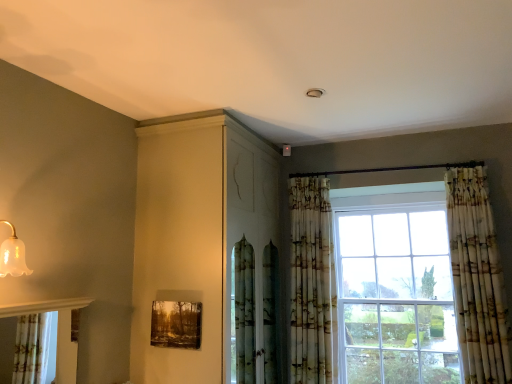
Image resolution: width=512 pixels, height=384 pixels. I want to click on matte white cabinet at upper center, so click(197, 233).

The height and width of the screenshot is (384, 512). I want to click on printed fabric curtain at center, the second curtain positioned from the right, so [311, 281].

Measure the distance between printed fabric curtain at right, which is the 2th curtain in left-to-right order, and camera.

printed fabric curtain at right, which is the 2th curtain in left-to-right order, is 8.75 feet away from camera.

Where is `matte white cabinet at upper center`? Image resolution: width=512 pixels, height=384 pixels. matte white cabinet at upper center is located at coordinates (197, 233).

Is wooden textured frame at lower center shorter than matte white cabinet at upper center?

Correct, wooden textured frame at lower center is not as tall as matte white cabinet at upper center.

Considering the positions of points (167, 337) and (206, 254), is point (167, 337) farther from camera compared to point (206, 254)?

No, (167, 337) is in front of (206, 254).

Between wooden textured frame at lower center and matte white cabinet at upper center, which one appears on the left side from the viewer's perspective?

From the viewer's perspective, wooden textured frame at lower center appears more on the left side.

Can you confirm if wooden textured frame at lower center is smaller than matte white cabinet at upper center?

Yes, wooden textured frame at lower center is smaller than matte white cabinet at upper center.

Is point (245, 129) farther from camera compared to point (177, 312)?

That is True.

Which object is further away from the camera taking this photo, matte white cabinet at upper center or wooden textured frame at lower center?

wooden textured frame at lower center is more distant.

Does matte white cabinet at upper center have a smaller size compared to wooden textured frame at lower center?

No, matte white cabinet at upper center is not smaller than wooden textured frame at lower center.

From the picture: Does printed fabric curtain at center, the second curtain positioned from the right, have a lesser height compared to matte white cabinet at upper center?

Indeed, printed fabric curtain at center, the second curtain positioned from the right, has a lesser height compared to matte white cabinet at upper center.

Is printed fabric curtain at center, the 1th curtain positioned from the left, smaller than matte white cabinet at upper center?

Yes, printed fabric curtain at center, the 1th curtain positioned from the left, is smaller than matte white cabinet at upper center.

Which object is further away from the camera taking this photo, printed fabric curtain at center, the second curtain positioned from the right, or matte white cabinet at upper center?

Positioned behind is printed fabric curtain at center, the second curtain positioned from the right.

Which of these two, wooden textured frame at lower center or printed fabric curtain at center, the second curtain positioned from the right, stands taller?

With more height is printed fabric curtain at center, the second curtain positioned from the right.

From the image's perspective, is wooden textured frame at lower center on top of printed fabric curtain at center, the second curtain positioned from the right?

Incorrect, from the image's perspective, wooden textured frame at lower center is lower than printed fabric curtain at center, the second curtain positioned from the right.

From a real-world perspective, which object stands above the other?

In real-world perspective, printed fabric curtain at center, the 1th curtain positioned from the left, is above.

Looking at this image, does wooden textured frame at lower center turn towards printed fabric curtain at center, the 1th curtain positioned from the left?

No, wooden textured frame at lower center is not oriented towards printed fabric curtain at center, the 1th curtain positioned from the left.

From a real-world perspective, which is physically below, translucent glass bell at upper left or printed fabric curtain at center, the 1th curtain positioned from the left?

From a 3D spatial view, printed fabric curtain at center, the 1th curtain positioned from the left, is below.

Is translucent glass bell at upper left closer to camera compared to printed fabric curtain at center, the second curtain positioned from the right?

Yes.

This screenshot has height=384, width=512. In order to click on light fixture in front of the printed fabric curtain at center, the second curtain positioned from the right in this screenshot , I will do `click(13, 255)`.

Can you confirm if translucent glass bell at upper left is positioned to the left of printed fabric curtain at center, the 1th curtain positioned from the left?

Yes, translucent glass bell at upper left is to the left of printed fabric curtain at center, the 1th curtain positioned from the left.

Considering the relative sizes of translucent glass bell at upper left and printed fabric curtain at right, which is the 2th curtain in left-to-right order, in the image provided, is translucent glass bell at upper left taller than printed fabric curtain at right, which is the 2th curtain in left-to-right order,?

Incorrect, the height of translucent glass bell at upper left is not larger of that of printed fabric curtain at right, which is the 2th curtain in left-to-right order.

Is translucent glass bell at upper left spatially inside printed fabric curtain at right, which is the 2th curtain in left-to-right order, or outside of it?

translucent glass bell at upper left is spatially situated outside printed fabric curtain at right, which is the 2th curtain in left-to-right order.

Considering the sizes of objects translucent glass bell at upper left and printed fabric curtain at right, positioned as the first curtain in right-to-left order, in the image provided, who is wider, translucent glass bell at upper left or printed fabric curtain at right, positioned as the first curtain in right-to-left order,?

printed fabric curtain at right, positioned as the first curtain in right-to-left order, is wider.

Is the position of translucent glass bell at upper left more distant than that of printed fabric curtain at right, positioned as the first curtain in right-to-left order?

No, it is in front of printed fabric curtain at right, positioned as the first curtain in right-to-left order.

From a real-world perspective, who is located lower, printed fabric curtain at center, the 1th curtain positioned from the left, or printed fabric curtain at right, positioned as the first curtain in right-to-left order?

printed fabric curtain at center, the 1th curtain positioned from the left, from a real-world perspective.

Considering the positions of objects printed fabric curtain at center, the 1th curtain positioned from the left, and printed fabric curtain at right, positioned as the first curtain in right-to-left order, in the image provided, who is more to the left, printed fabric curtain at center, the 1th curtain positioned from the left, or printed fabric curtain at right, positioned as the first curtain in right-to-left order,?

printed fabric curtain at center, the 1th curtain positioned from the left, is more to the left.

Is printed fabric curtain at center, the 1th curtain positioned from the left, aimed at printed fabric curtain at right, positioned as the first curtain in right-to-left order?

No, printed fabric curtain at center, the 1th curtain positioned from the left, does not turn towards printed fabric curtain at right, positioned as the first curtain in right-to-left order.

In order to click on picture frame that is behind the matte white cabinet at upper center in this screenshot , I will do `click(176, 324)`.

This screenshot has height=384, width=512. In order to click on picture frame lying on the left of matte white cabinet at upper center in this screenshot , I will do `click(176, 324)`.

When comparing their distances from matte white cabinet at upper center, does translucent glass bell at upper left or wooden textured frame at lower center seem closer?

wooden textured frame at lower center.

Looking at the image, which one is located further to translucent glass bell at upper left, wooden textured frame at lower center or matte white cabinet at upper center?

Based on the image, matte white cabinet at upper center appears to be further to translucent glass bell at upper left.

Estimate the real-world distances between objects in this image. Which object is further from printed fabric curtain at right, positioned as the first curtain in right-to-left order, wooden textured frame at lower center or matte white cabinet at upper center?

wooden textured frame at lower center is further to printed fabric curtain at right, positioned as the first curtain in right-to-left order.

Based on the photo, when comparing their distances from wooden textured frame at lower center, does matte white cabinet at upper center or translucent glass bell at upper left seem further?

Among the two, translucent glass bell at upper left is located further to wooden textured frame at lower center.

When comparing their distances from printed fabric curtain at right, which is the 2th curtain in left-to-right order, does matte white cabinet at upper center or translucent glass bell at upper left seem closer?

matte white cabinet at upper center lies closer to printed fabric curtain at right, which is the 2th curtain in left-to-right order, than the other object.

From the image, which object appears to be farther from printed fabric curtain at center, the second curtain positioned from the right, translucent glass bell at upper left or matte white cabinet at upper center?

The object further to printed fabric curtain at center, the second curtain positioned from the right, is translucent glass bell at upper left.

From the image, which object appears to be nearer to translucent glass bell at upper left, matte white cabinet at upper center or printed fabric curtain at right, which is the 2th curtain in left-to-right order?

matte white cabinet at upper center.

Considering their positions, is translucent glass bell at upper left positioned further to printed fabric curtain at right, positioned as the first curtain in right-to-left order, than wooden textured frame at lower center?

Answer: translucent glass bell at upper left is further to printed fabric curtain at right, positioned as the first curtain in right-to-left order.

Image resolution: width=512 pixels, height=384 pixels. What are the coordinates of `curtain located between translucent glass bell at upper left and printed fabric curtain at right, positioned as the first curtain in right-to-left order, in the left-right direction` in the screenshot? It's located at (311, 281).

Locate an element on the screen. The width and height of the screenshot is (512, 384). dresser between translucent glass bell at upper left and printed fabric curtain at center, the 1th curtain positioned from the left, from left to right is located at coordinates (197, 233).

What are the coordinates of `dresser situated between wooden textured frame at lower center and printed fabric curtain at center, the 1th curtain positioned from the left, from left to right` in the screenshot? It's located at (197, 233).

At what (x,y) coordinates should I click in order to perform the action: click on curtain between matte white cabinet at upper center and printed fabric curtain at right, which is the 2th curtain in left-to-right order. Please return your answer as a coordinate pair (x, y). This screenshot has height=384, width=512. Looking at the image, I should click on (311, 281).